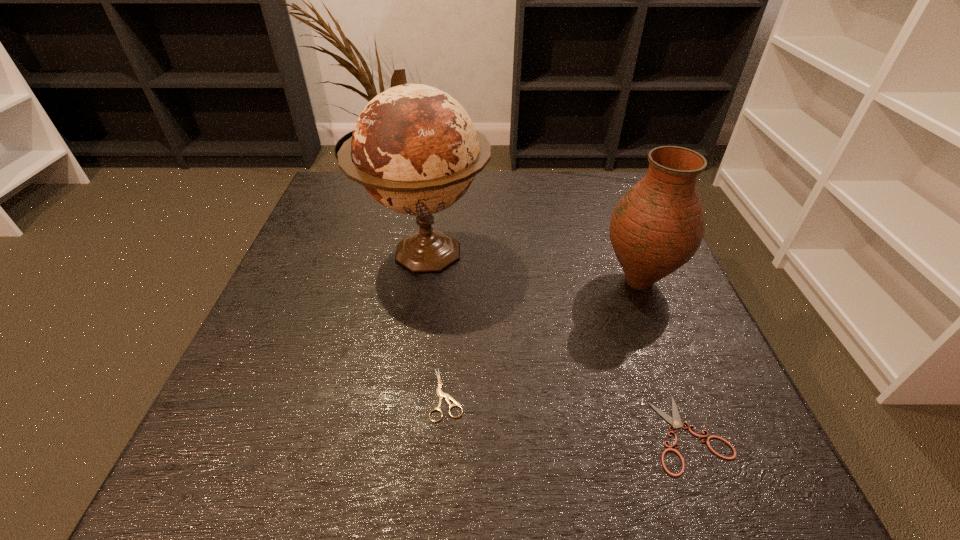
Where is `vacant space that satisfies the following two spatial constraints: 1. on the front of the globe showing Asia; 2. on the left side of the vase`? Image resolution: width=960 pixels, height=540 pixels. vacant space that satisfies the following two spatial constraints: 1. on the front of the globe showing Asia; 2. on the left side of the vase is located at coordinates (421, 281).